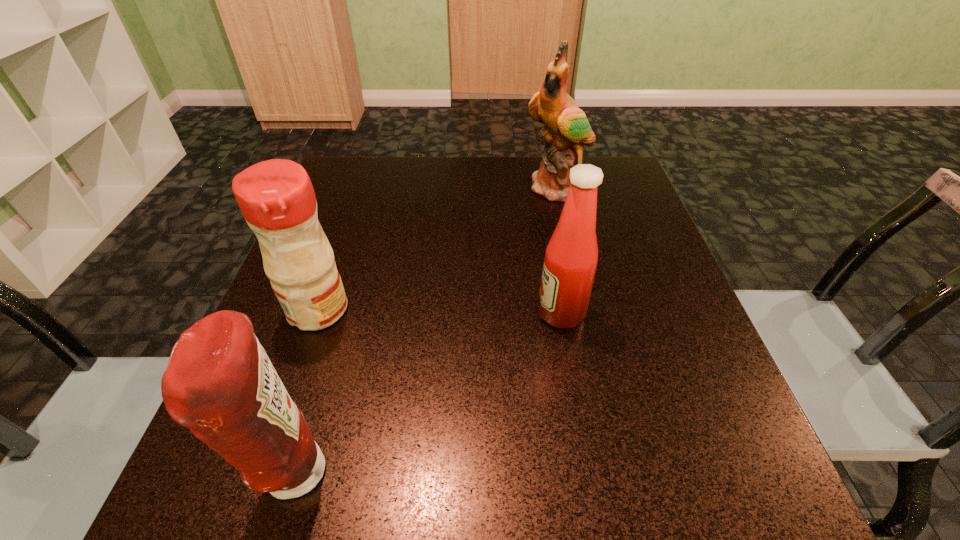
The height and width of the screenshot is (540, 960). Find the location of `free region that satisfies the following two spatial constraints: 1. on the front-facing side of the parrot; 2. on the front-facing side of the rightmost condiment`. free region that satisfies the following two spatial constraints: 1. on the front-facing side of the parrot; 2. on the front-facing side of the rightmost condiment is located at coordinates (585, 313).

The width and height of the screenshot is (960, 540). What are the coordinates of `free space that satisfies the following two spatial constraints: 1. on the front-facing side of the tallest object; 2. on the front-facing side of the rightmost condiment` in the screenshot? It's located at (585, 313).

Find the location of a particular element. free spot that satisfies the following two spatial constraints: 1. on the front-facing side of the parrot; 2. on the front-facing side of the rightmost condiment is located at coordinates (585, 313).